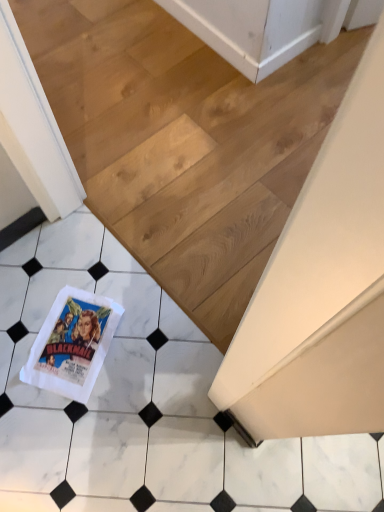
Question: Relative to white marble tile at lower left, is white marble tile at lower left in front or behind?

Choices:
 (A) behind
 (B) front

Answer: (B)

Question: Is white marble tile at lower left wider or thinner than white marble tile at lower left?

Choices:
 (A) wide
 (B) thin

Answer: (A)

Question: Which object is positioned closest to the white marble tile at lower left?

Choices:
 (A) white marble tile at lower left
 (B) white paper towel at lower left

Answer: (A)

Question: Which is nearer to the white paper towel at lower left?

Choices:
 (A) white marble tile at lower left
 (B) white marble tile at lower left

Answer: (A)